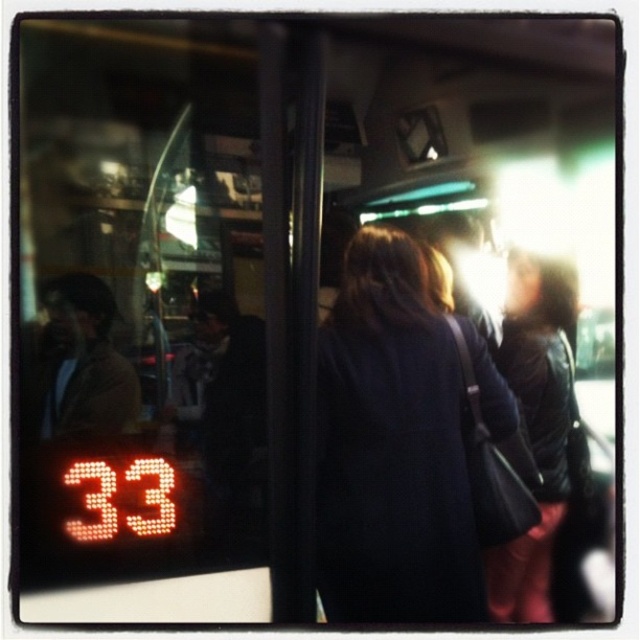
You are a passenger on a bus and you see the dark blue coat at center and the dark brown leather jacket at right. Which one is larger in size?

The dark blue coat at center is bigger than the dark brown leather jacket at right.

You are a passenger on a bus and you see a dark blue coat at center and a dark brown leather jacket at right. Which clothing item is closer to the left side of the bus?

The dark blue coat at center is closer to the left side of the bus because it is positioned to the left of the dark brown leather jacket at right.

You are a passenger on a moving bus and need to exit at the next stop. You see the dark blue coat at center and the dark brown leather jacket at right. Which person is closer to the exit door?

The dark blue coat at center is closer to the exit door because it is in front of the dark brown leather jacket at right, indicating proximity to the exit.